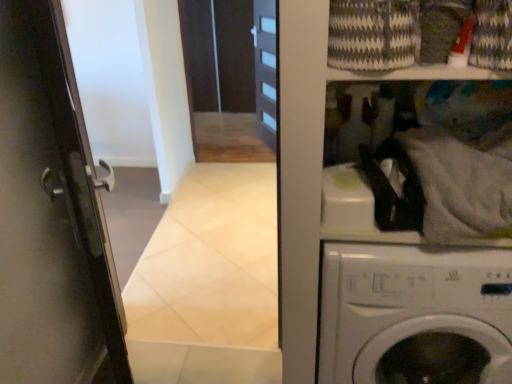
Question: Choose the correct answer: Is knitted wool laundry basket at upper right inside white matte washing machine at upper right or outside it?

Choices:
 (A) outside
 (B) inside

Answer: (A)

Question: Looking at the image, does knitted wool laundry basket at upper right seem bigger or smaller compared to white matte washing machine at upper right?

Choices:
 (A) big
 (B) small

Answer: (B)

Question: Considering the positions of knitted wool laundry basket at upper right and white matte washing machine at upper right in the image, is knitted wool laundry basket at upper right taller or shorter than white matte washing machine at upper right?

Choices:
 (A) short
 (B) tall

Answer: (A)

Question: Is white matte washing machine at upper right wider or thinner than knitted wool laundry basket at upper right?

Choices:
 (A) thin
 (B) wide

Answer: (B)

Question: Would you say white matte washing machine at upper right is inside or outside knitted wool laundry basket at upper right?

Choices:
 (A) inside
 (B) outside

Answer: (B)

Question: Considering the relative positions of white matte washing machine at upper right and knitted wool laundry basket at upper right in the image provided, is white matte washing machine at upper right to the left or to the right of knitted wool laundry basket at upper right?

Choices:
 (A) right
 (B) left

Answer: (A)

Question: In terms of height, does white matte washing machine at upper right look taller or shorter compared to knitted wool laundry basket at upper right?

Choices:
 (A) tall
 (B) short

Answer: (A)